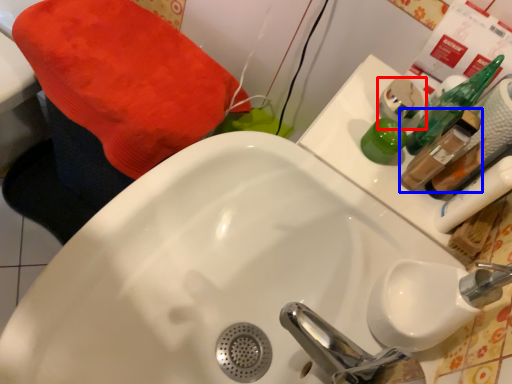
Question: Among these objects, which one is farthest to the camera, mouthwash (highlighted by a red box) or mouthwash (highlighted by a blue box)?

Choices:
 (A) mouthwash
 (B) mouthwash

Answer: (A)